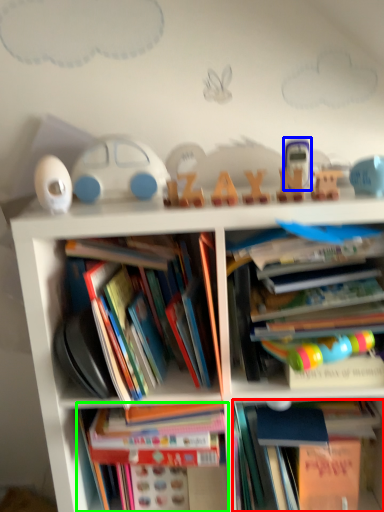
Question: Which object is positioned closest to book (highlighted by a red box)? Select from toy (highlighted by a blue box) and book (highlighted by a green box).

Choices:
 (A) toy
 (B) book

Answer: (B)